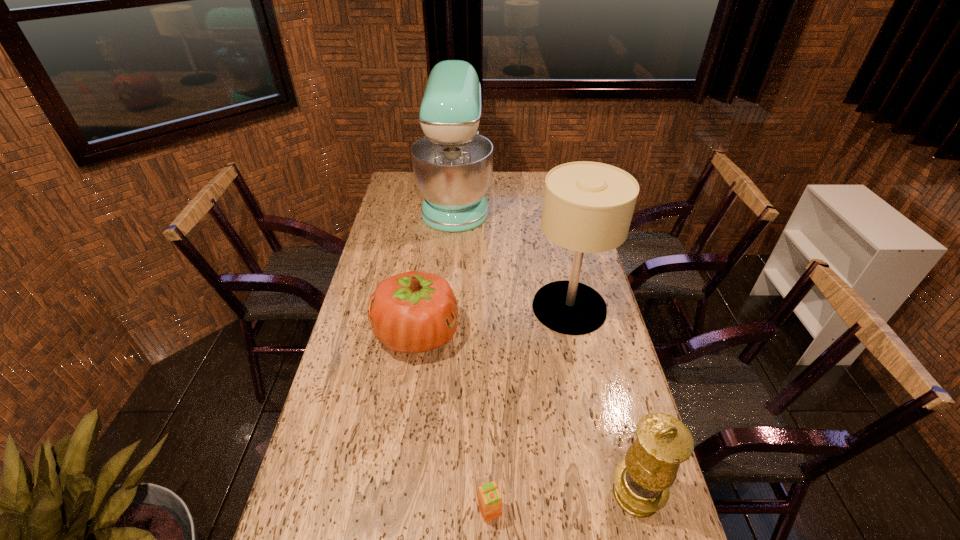
This screenshot has width=960, height=540. I want to click on object present at the far edge, so (x=452, y=164).

Locate an element on the screen. The image size is (960, 540). mixer situated at the left edge is located at coordinates (452, 164).

Locate an element on the screen. The width and height of the screenshot is (960, 540). pumpkin that is at the left edge is located at coordinates (412, 312).

You are a GUI agent. You are given a task and a screenshot of the screen. Output one action in this format:
    pyautogui.click(x=<x>, y=<y>)
    Task: Click on the table lamp situated at the right edge
    
    Given the screenshot: What is the action you would take?
    pyautogui.click(x=588, y=206)

Identify the location of oil lamp that is positioned at the right edge. click(642, 482).

In order to click on object present at the far left corner in this screenshot , I will do `click(452, 164)`.

Find the location of a particular element. free space at the far edge is located at coordinates (525, 193).

Locate an element on the screen. free space at the left edge is located at coordinates (367, 301).

This screenshot has width=960, height=540. In the image, there is a desktop. What are the coordinates of `vacant space at the right edge` in the screenshot? It's located at (x=625, y=530).

This screenshot has height=540, width=960. In order to click on free space between the table lamp and the fourth tallest object in this screenshot , I will do `click(493, 321)`.